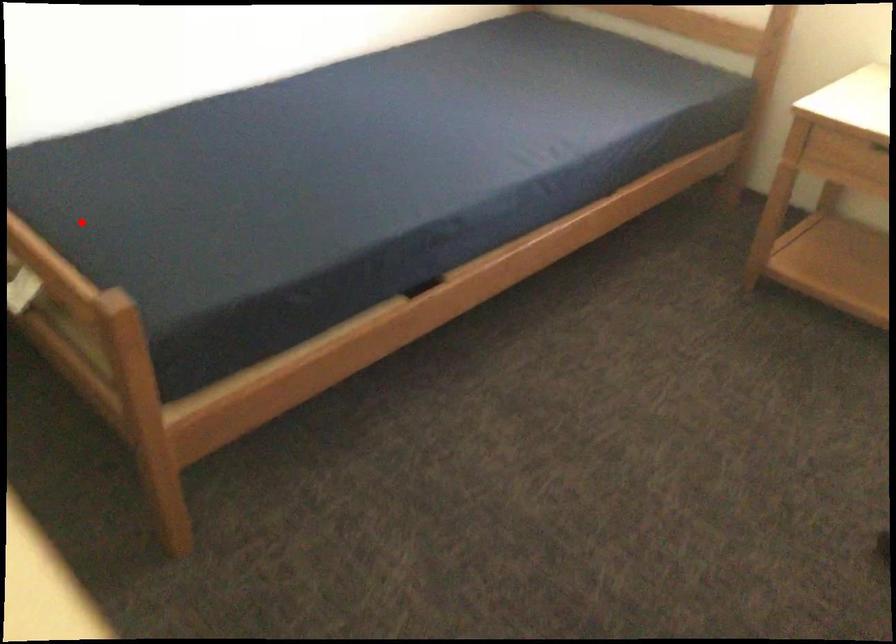
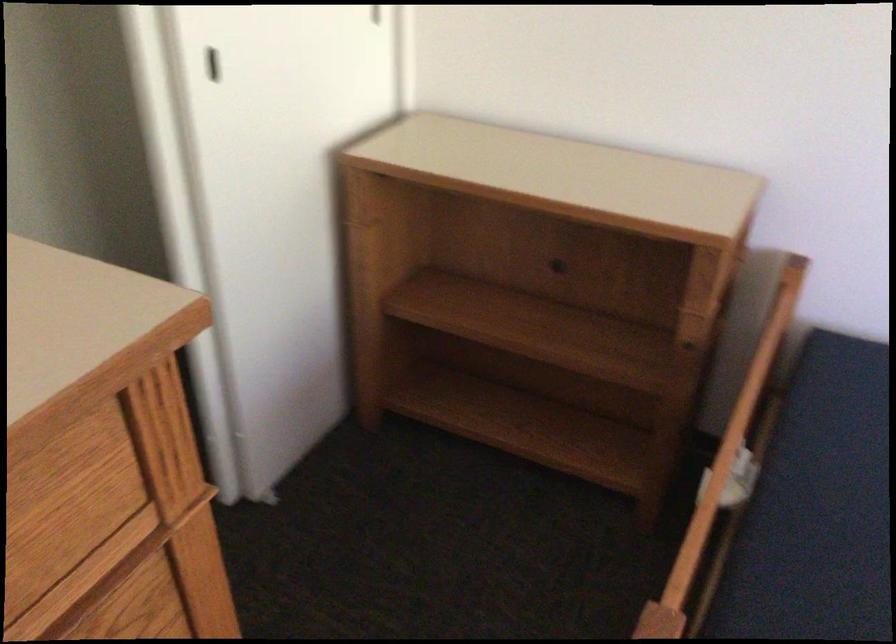
Question: I am providing you with two images of the same scene from different viewpoints. Image1 has a red point marked. In image2, the corresponding 3D location appears at what relative position? Reply with the corresponding letter.

Choices:
 (A) Closer
 (B) Farther

Answer: (A)